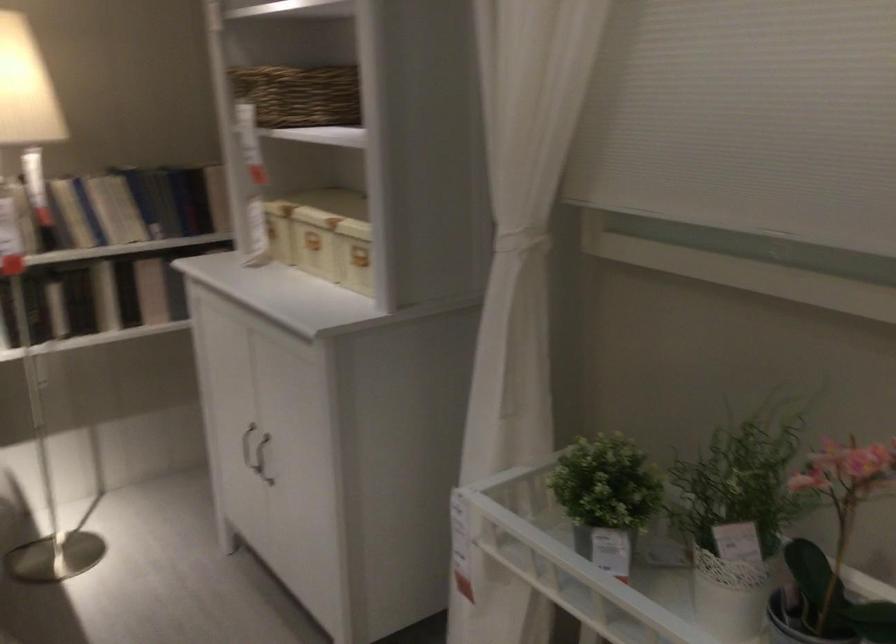
The location [839,542] corresponds to which object?

It refers to a potted pink orchid.